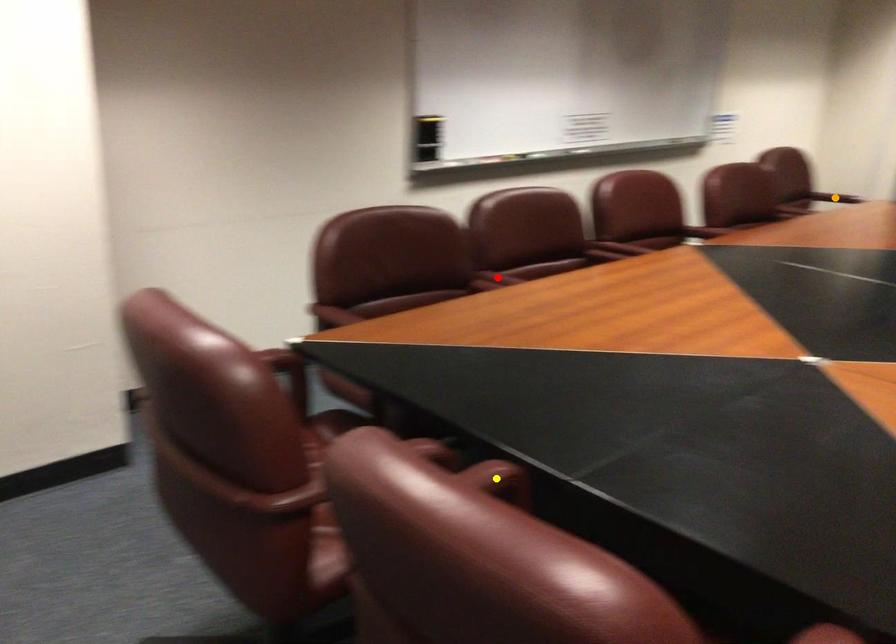
Order these from nearest to farthest:
red point
yellow point
orange point

yellow point → red point → orange point